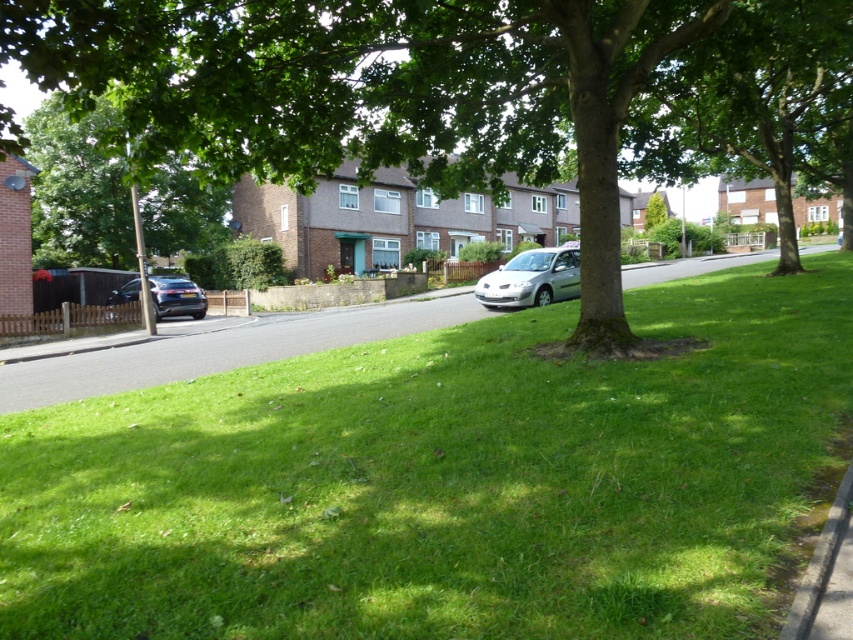
You are a pedestrian standing on the sidewalk and want to cross the road to reach the gray concrete curb at lower right. The satin silver car at center is blocking your path. Can you walk around the car to get to the curb?

The satin silver car at center is further to the viewer than the gray concrete curb at lower right, so you can walk around the car to reach the curb since it is closer to you.

From the picture: You are a gardener planning to mow the green grass at lower center. However, the satin black car at left is currently blocking access to the grass. Can you mow the grass without moving the car?

The green grass at lower center is positioned over the satin black car at left, which means the car is underneath the grass area. Since the car is blocking access, you cannot mow the grass without moving the car.

You are a gardener who wants to mow the green grass at lower center. The satin silver car at center is parked nearby. Can you safely mow the grass without hitting the car?

The green grass at lower center is taller than the satin silver car at center, so mowing it would not pose a risk of hitting the car since the car is lower in height.